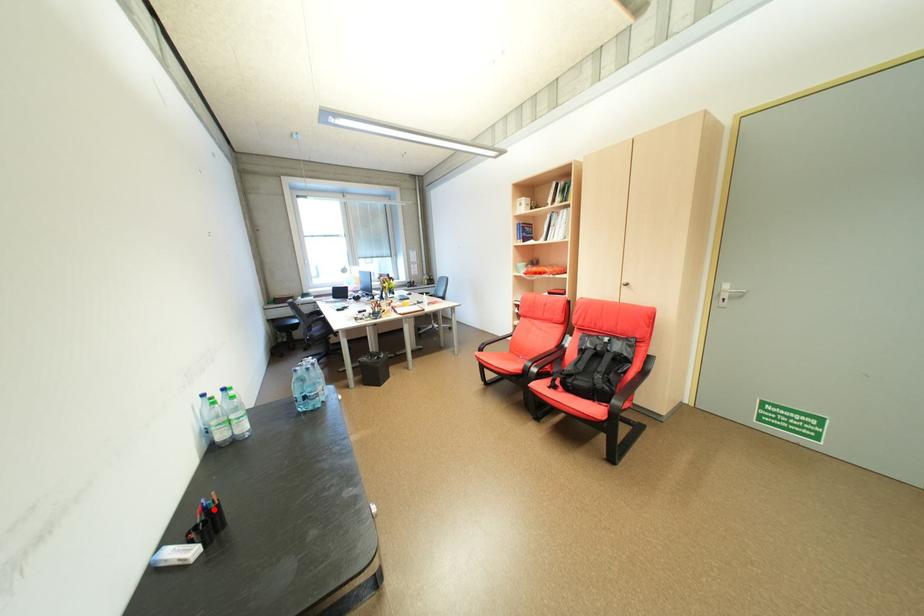
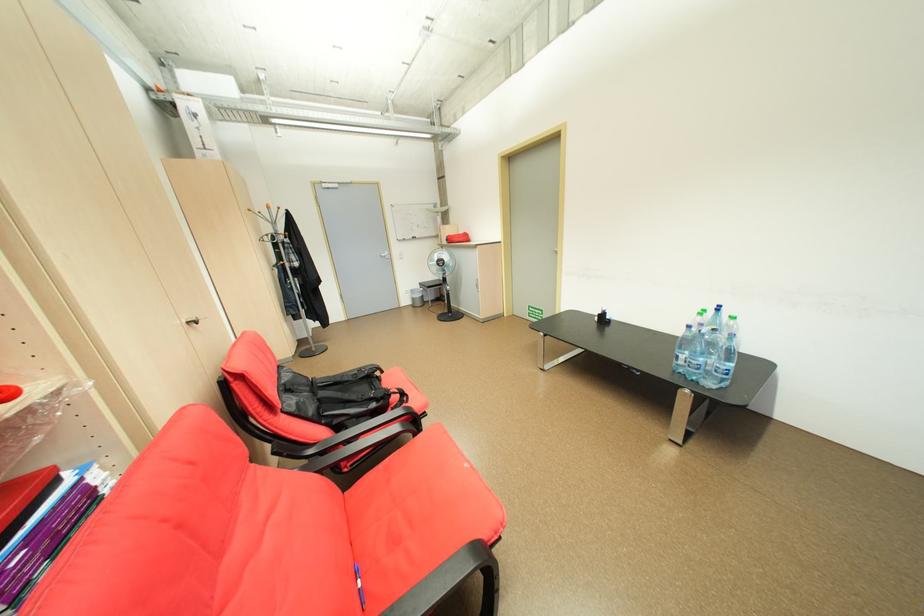
Question: I am providing you with two images of the same scene from different viewpoints. In image1, a red point is highlighted. Considering the same 3D point in image2, which of the following is correct?

Choices:
 (A) It is closer
 (B) It is farther

Answer: (A)